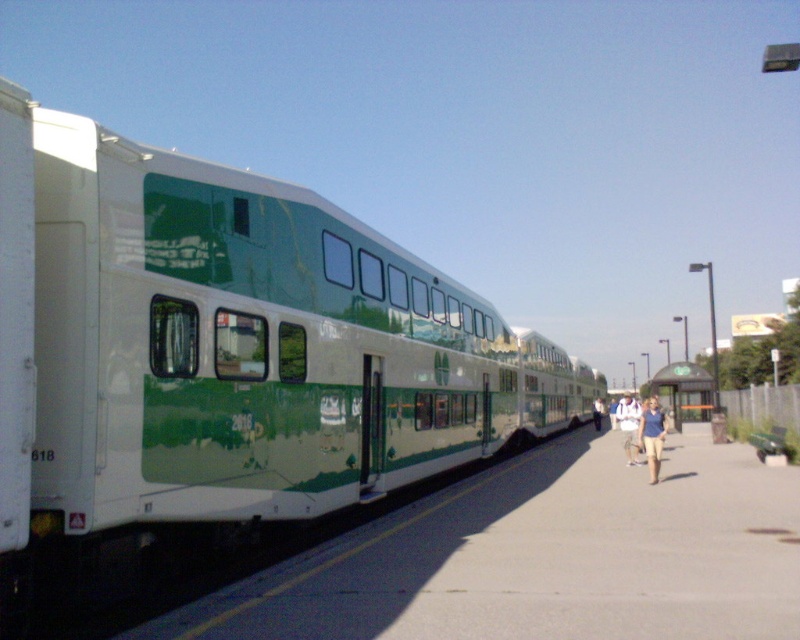
Is blue cotton shirt at center taller than light blue shirt at center?

Indeed, blue cotton shirt at center has a greater height compared to light blue shirt at center.

How much distance is there between blue cotton shirt at center and light blue shirt at center?

blue cotton shirt at center is 95.81 feet from light blue shirt at center.

What do you see at coordinates (652, 435) in the screenshot? I see `blue cotton shirt at center` at bounding box center [652, 435].

Locate an element on the screen. The width and height of the screenshot is (800, 640). blue cotton shirt at center is located at coordinates (652, 435).

Is light blue jeans at center wider than light blue shirt at center?

Yes, light blue jeans at center is wider than light blue shirt at center.

Which is behind, point (620, 422) or point (600, 403)?

Point (600, 403)

This screenshot has width=800, height=640. Find the location of `light blue jeans at center`. light blue jeans at center is located at coordinates (629, 426).

Between point (228, 449) and point (662, 374), which one is positioned in front?

Point (228, 449) is more forward.

Can you confirm if green glossy train at left is shorter than green matte bus stop at center?

No, green glossy train at left is not shorter than green matte bus stop at center.

Which is behind, point (486, 312) or point (690, 392)?

The point (690, 392) is behind.

At what (x,y) coordinates should I click in order to perform the action: click on green glossy train at left. Please return your answer as a coordinate pair (x, y). The width and height of the screenshot is (800, 640). Looking at the image, I should click on (220, 358).